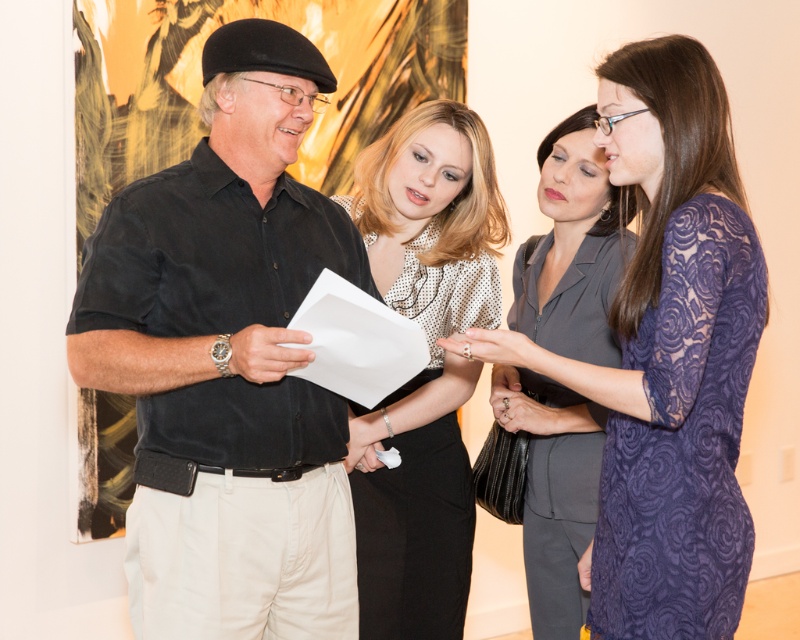
Does black cotton shirt at center appear under matte gray suit at center?

Actually, black cotton shirt at center is above matte gray suit at center.

Which of these two, black cotton shirt at center or matte gray suit at center, stands taller?

matte gray suit at center is taller.

Who is more distant from viewer, (234,221) or (544,632)?

Positioned behind is point (544,632).

Where is `black cotton shirt at center`? The width and height of the screenshot is (800, 640). black cotton shirt at center is located at coordinates (228, 360).

Does lace fabric dress at center have a greater width compared to polka dot blouse at center?

Yes.

Who is positioned more to the left, lace fabric dress at center or polka dot blouse at center?

From the viewer's perspective, polka dot blouse at center appears more on the left side.

Which is behind, point (621, 116) or point (456, 432)?

The point (456, 432) is behind.

In order to click on lace fabric dress at center in this screenshot , I will do `click(668, 355)`.

Is point (422, 385) positioned behind point (562, 212)?

No, it is in front of (562, 212).

Can you confirm if polka dot blouse at center is bigger than matte gray suit at center?

Actually, polka dot blouse at center might be smaller than matte gray suit at center.

Who is more forward, (402, 168) or (541, 310)?

Point (402, 168) is more forward.

Where is `polka dot blouse at center`? The width and height of the screenshot is (800, 640). polka dot blouse at center is located at coordinates (425, 368).